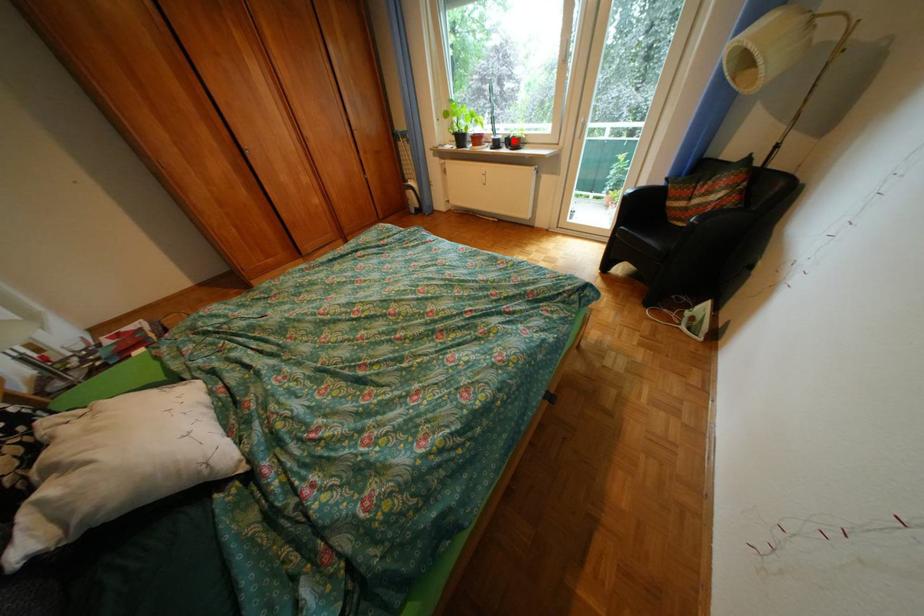
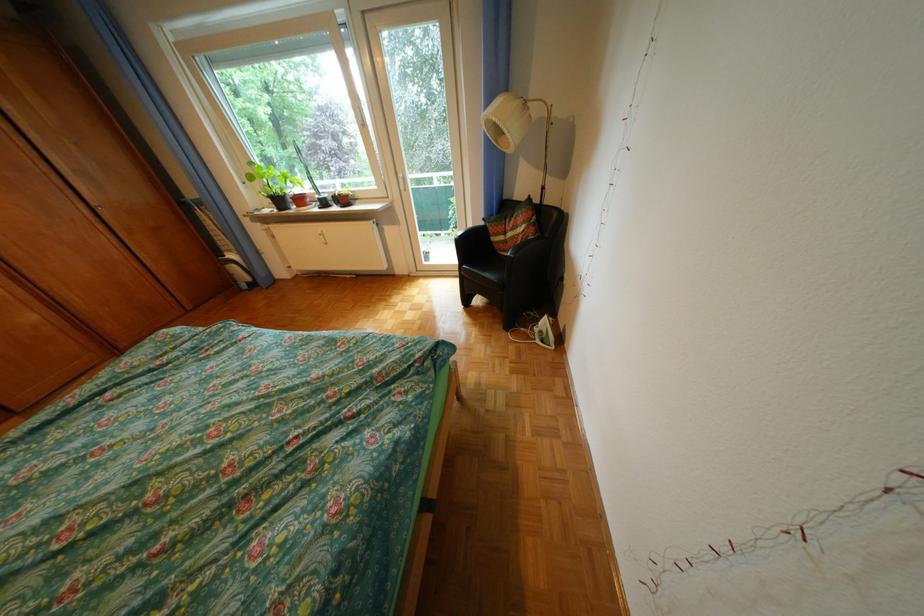
Where in the second image is the point corresponding to the highlighted location from the first image?

(341, 199)